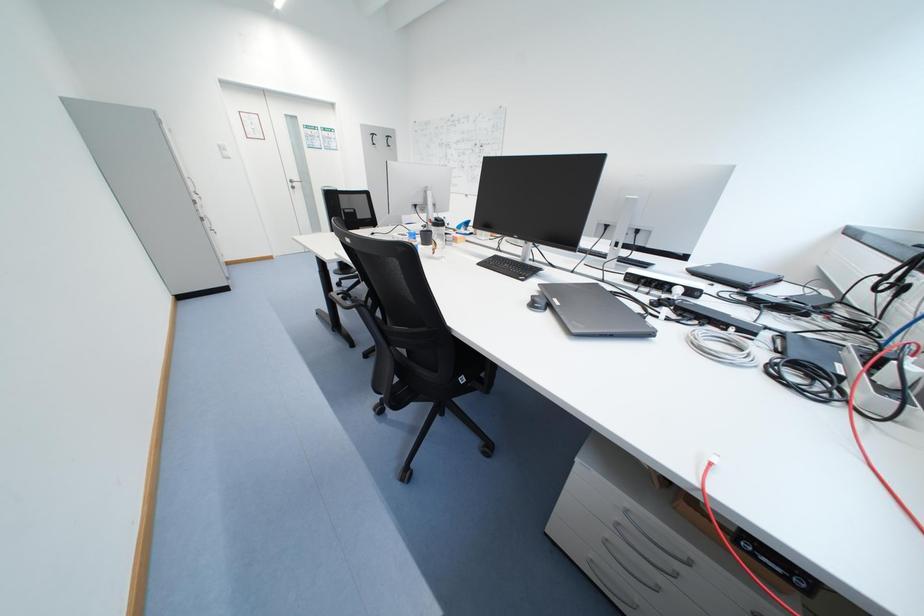
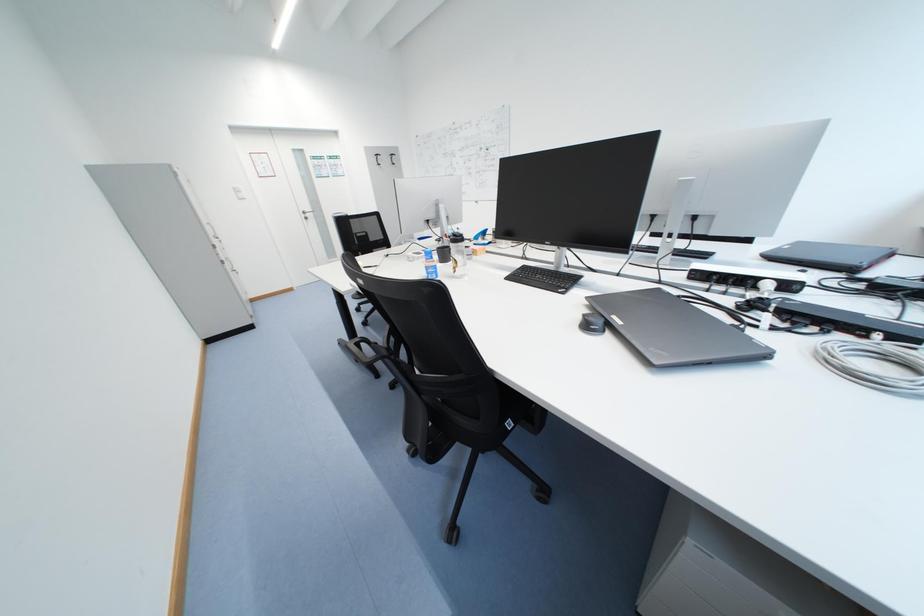
Question: The camera is either moving clockwise (left) or counter-clockwise (right) around the object. The first image is from the beginning of the video and the second image is from the end. Is the camera moving left or right when shooting the video?

Choices:
 (A) Left
 (B) Right

Answer: (B)